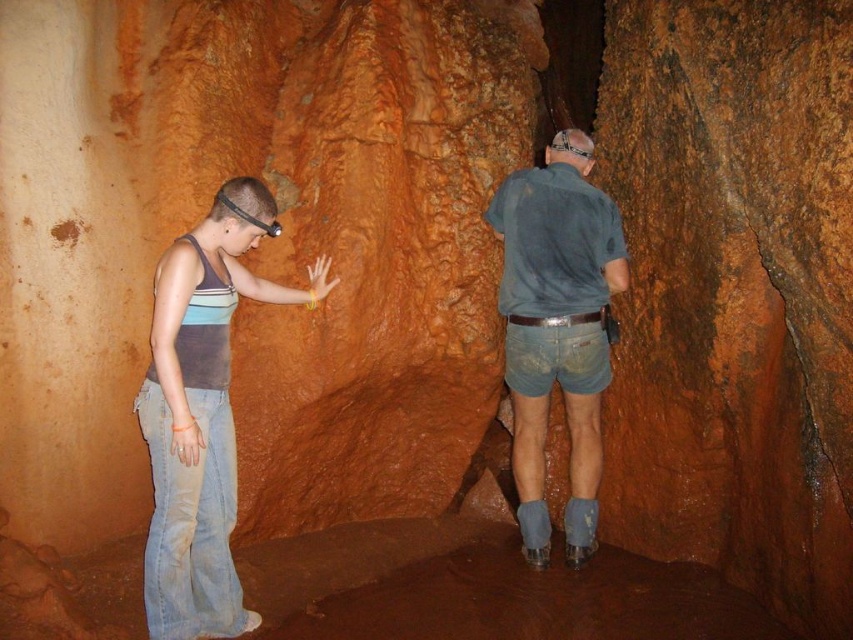
Does denim jeans at left have a greater height compared to blue denim shorts at right?

No, denim jeans at left is not taller than blue denim shorts at right.

Measure the distance between point (181,477) and camera.

The distance of point (181,477) from camera is 9.65 feet.

Locate an element on the screen. The height and width of the screenshot is (640, 853). denim jeans at left is located at coordinates (x=202, y=413).